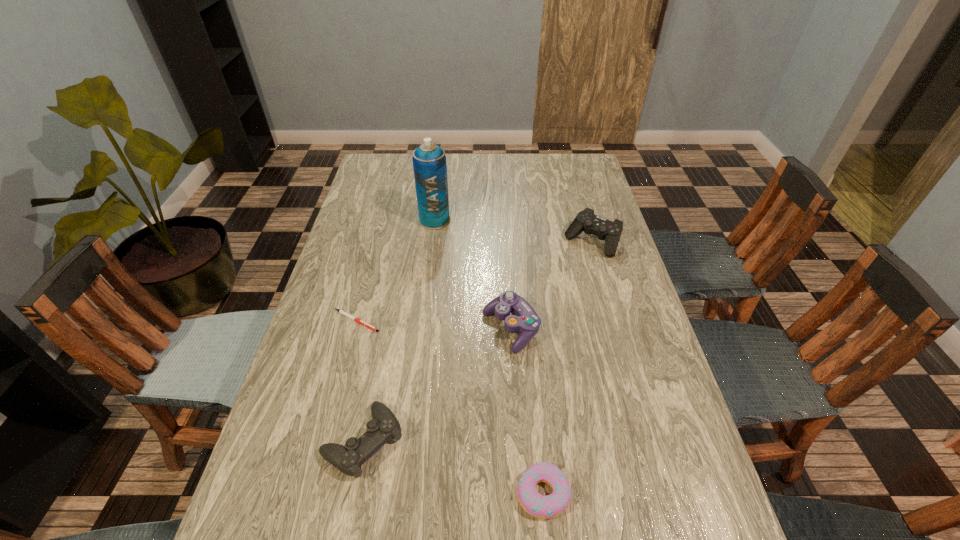
You are a GUI agent. You are given a task and a screenshot of the screen. Output one action in this format:
    pyautogui.click(x=<x>, y=<y>)
    Task: Click on the tallest object
    This screenshot has width=960, height=540.
    Given the screenshot: What is the action you would take?
    pyautogui.click(x=429, y=160)

Where is `the farthest control`? This screenshot has height=540, width=960. the farthest control is located at coordinates (586, 220).

Find the location of a particular element. The height and width of the screenshot is (540, 960). the rightmost control is located at coordinates (586, 220).

Locate an element on the screen. Image resolution: width=960 pixels, height=540 pixels. the second farthest control is located at coordinates (524, 319).

I want to click on the nearest control, so click(x=348, y=459).

You are a GUI agent. You are given a task and a screenshot of the screen. Output one action in this format:
    pyautogui.click(x=<x>, y=<y>)
    Task: Click on the fourth tallest object
    
    Given the screenshot: What is the action you would take?
    pyautogui.click(x=348, y=459)

Identify the location of doughnut. (548, 506).

At what (x,y) coordinates should I click in order to perform the action: click on the shortest object. Please return your answer as a coordinate pair (x, y). The width and height of the screenshot is (960, 540). Looking at the image, I should click on tap(340, 311).

The image size is (960, 540). I want to click on free space located 0.150m on the back of the tallest object, so click(x=439, y=188).

The width and height of the screenshot is (960, 540). Find the location of `blank area located 0.360m on the back of the farthest control`. blank area located 0.360m on the back of the farthest control is located at coordinates (572, 171).